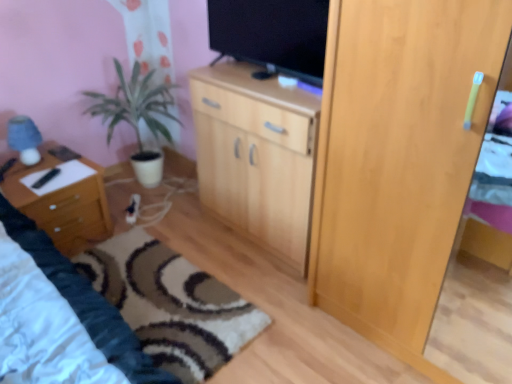
This screenshot has height=384, width=512. I want to click on free space below green matte plant at left (from a real-world perspective), so click(158, 189).